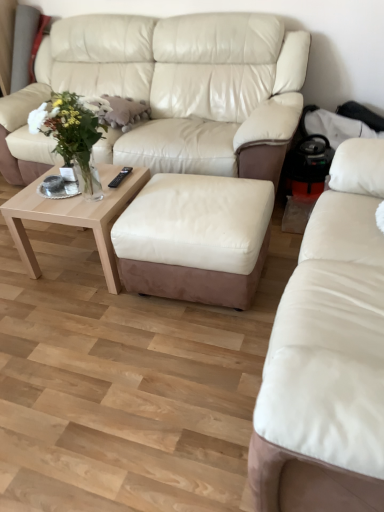
Identify the location of vacant space to the left of white leather ottoman at center. The height and width of the screenshot is (512, 384). (84, 316).